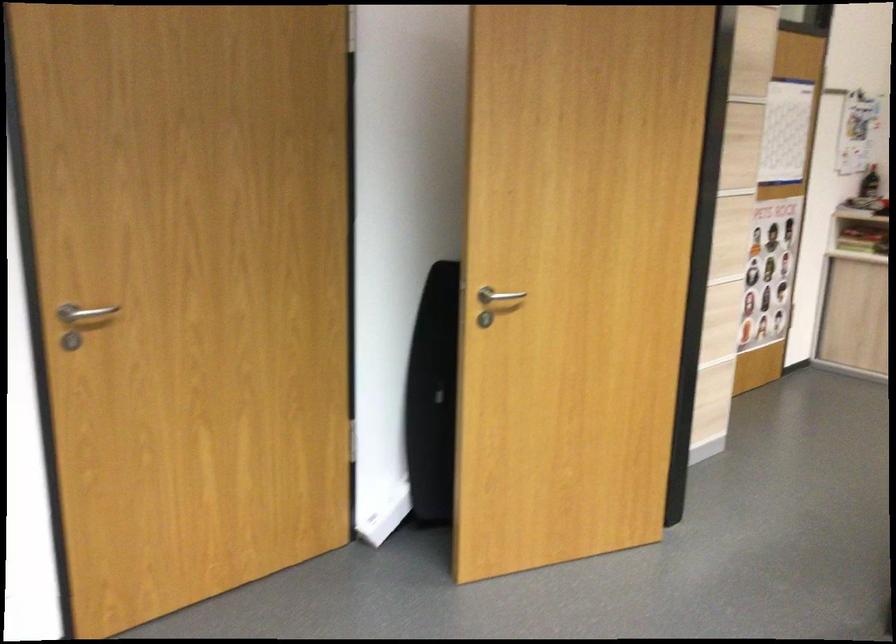
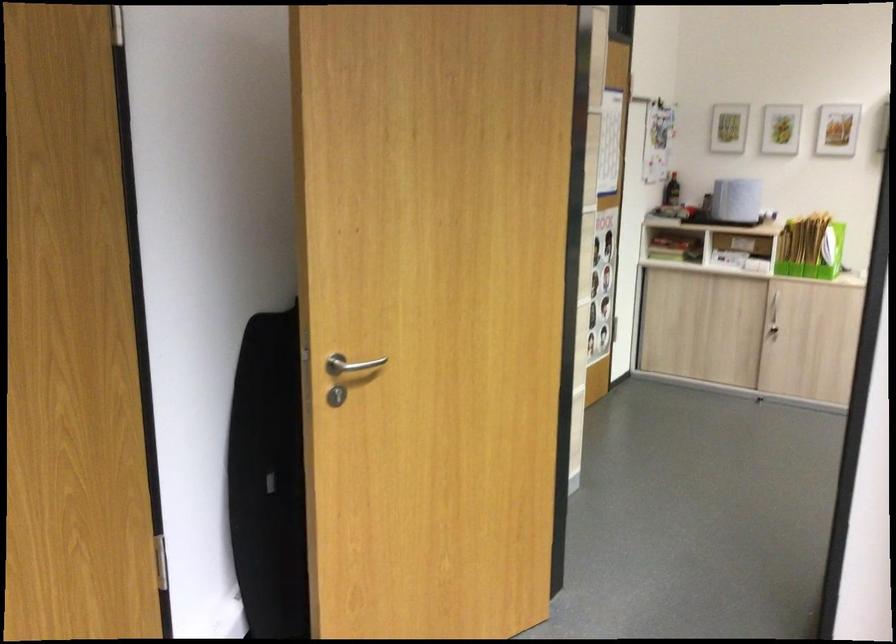
Where in the second image is the point corresponding to (497,294) from the first image?

(350, 365)